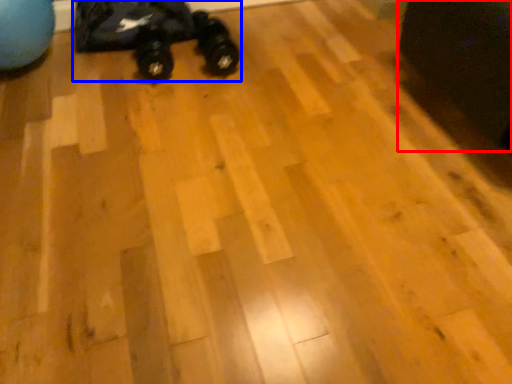
Question: Which object is further to the camera taking this photo, swivel chair (highlighted by a red box) or toy car (highlighted by a blue box)?

Choices:
 (A) swivel chair
 (B) toy car

Answer: (B)